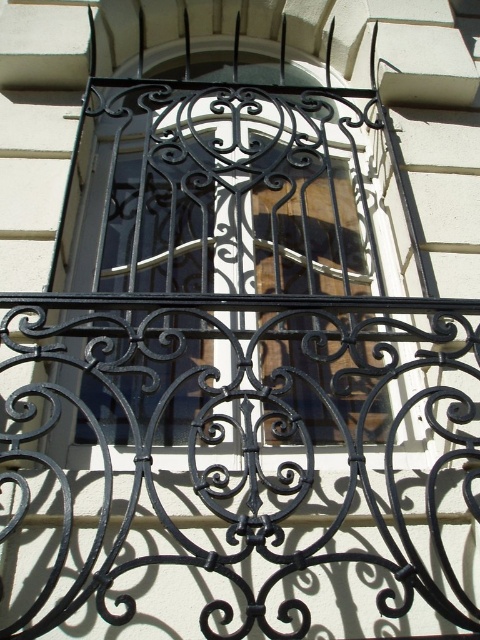
Question: Can you confirm if black wrought iron balcony at center is smaller than black wrought iron at center?

Choices:
 (A) yes
 (B) no

Answer: (B)

Question: Which point is closer to the camera?

Choices:
 (A) (84, 531)
 (B) (249, 353)

Answer: (A)

Question: Does black wrought iron balcony at center lie behind black wrought iron at center?

Choices:
 (A) yes
 (B) no

Answer: (B)

Question: Which point is closer to the camera?

Choices:
 (A) black wrought iron at center
 (B) black wrought iron balcony at center

Answer: (B)

Question: Which of the following is the farthest from the observer?

Choices:
 (A) black wrought iron at center
 (B) black wrought iron balcony at center

Answer: (A)

Question: From the image, what is the correct spatial relationship of black wrought iron balcony at center in relation to black wrought iron at center?

Choices:
 (A) right
 (B) left

Answer: (A)